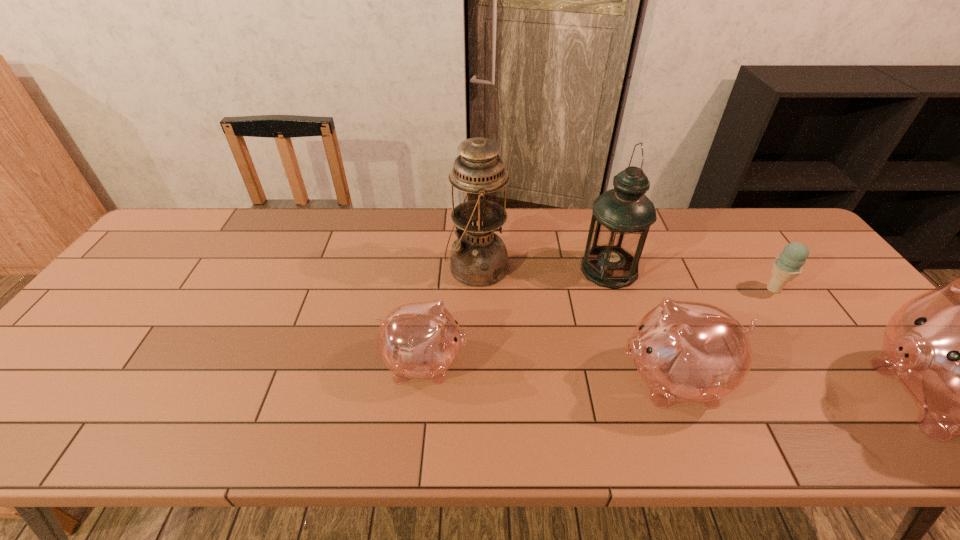
Where is `free space between the second shortest piggy bank and the leftmost piggy bank`? free space between the second shortest piggy bank and the leftmost piggy bank is located at coordinates (548, 371).

Locate an element on the screen. the fourth closest object relative to the second tallest piggy bank is located at coordinates (479, 258).

Identify which object is the fourth nearest to the third shortest object. Please provide its 2D coordinates. Your answer should be formatted as a tuple, i.e. [(x, y)], where the tuple contains the x and y coordinates of a point satisfying the conditions above.

[(479, 258)]

Select which piggy bank is the second closest to the third tallest object. Please provide its 2D coordinates. Your answer should be formatted as a tuple, i.e. [(x, y)], where the tuple contains the x and y coordinates of a point satisfying the conditions above.

[(422, 340)]

Identify which piggy bank is located as the nearest to the second shortest piggy bank. Please provide its 2D coordinates. Your answer should be formatted as a tuple, i.e. [(x, y)], where the tuple contains the x and y coordinates of a point satisfying the conditions above.

[(959, 350)]

Where is `free point that satisfies the following two spatial constraints: 1. on the front facing side of the left oil lamp; 2. on the right side of the leftmost piggy bank`? free point that satisfies the following two spatial constraints: 1. on the front facing side of the left oil lamp; 2. on the right side of the leftmost piggy bank is located at coordinates (436, 267).

Find the location of a particular element. vacant space that satisfies the following two spatial constraints: 1. on the front side of the right oil lamp; 2. on the right side of the left oil lamp is located at coordinates (477, 269).

Locate an element on the screen. This screenshot has width=960, height=540. vacant point that satisfies the following two spatial constraints: 1. on the front side of the ice cream; 2. on the front facing side of the fourth tallest object is located at coordinates (836, 380).

Find the location of a particular element. Image resolution: width=960 pixels, height=540 pixels. vacant space that satisfies the following two spatial constraints: 1. on the front facing side of the right oil lamp; 2. on the left side of the leftmost piggy bank is located at coordinates (436, 269).